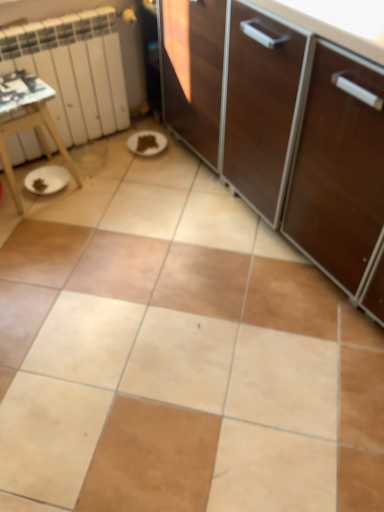
Question: Is white matte radiator at left bigger or smaller than white wooden table at left?

Choices:
 (A) big
 (B) small

Answer: (A)

Question: In terms of width, does white matte radiator at left look wider or thinner when compared to white wooden table at left?

Choices:
 (A) wide
 (B) thin

Answer: (B)

Question: Is white matte radiator at left taller or shorter than white wooden table at left?

Choices:
 (A) tall
 (B) short

Answer: (A)

Question: From the image's perspective, is white wooden table at left located above or below white matte radiator at left?

Choices:
 (A) above
 (B) below

Answer: (B)

Question: Based on their positions, is white wooden table at left located to the left or right of white matte radiator at left?

Choices:
 (A) right
 (B) left

Answer: (B)

Question: Is white wooden table at left taller or shorter than white matte radiator at left?

Choices:
 (A) short
 (B) tall

Answer: (A)

Question: Does point (39, 87) appear closer or farther from the camera than point (31, 49)?

Choices:
 (A) closer
 (B) farther

Answer: (A)